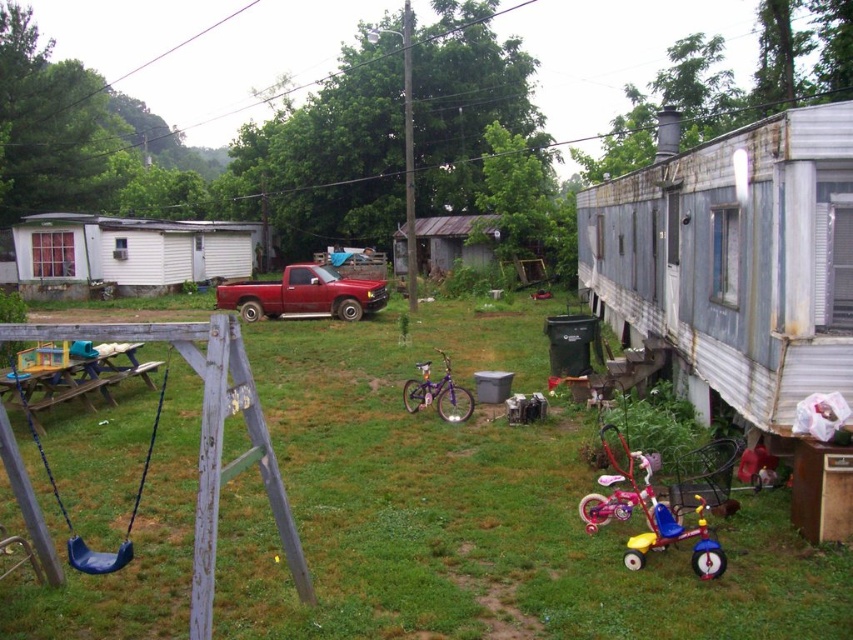
You are a parent who wants to let your child play outside. There is green grass at center and a metallic pink tricycle at lower right. Which area is bigger for the child to play in?

The green grass at center is larger in size than the metallic pink tricycle at lower right, so the child has more space to play in the green grass at center.

You are a parent trying to park your metallic pink tricycle at lower right next to the blue plastic swing at lower left. Considering their sizes, will the tricycle fit comfortably without overlapping the swing?

The metallic pink tricycle at lower right has a lesser width compared to the blue plastic swing at lower left, so it should fit comfortably next to it without overlapping.

Please see the image. There is a point at coordinate (648, 513). What object is this point located on?

The point at coordinate (648, 513) is located on the metallic pink tricycle at lower right.